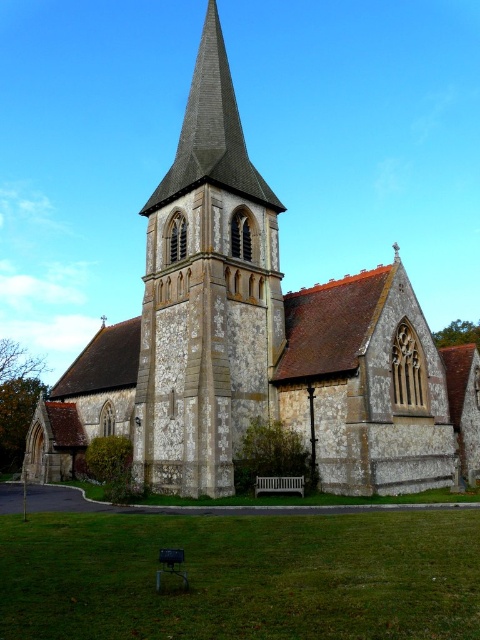
Does stone church at center have a greater height compared to stone spire at center?

Indeed, stone church at center has a greater height compared to stone spire at center.

Can you confirm if stone church at center is shorter than stone spire at center?

Incorrect, stone church at center's height does not fall short of stone spire at center's.

Is point (280, 392) farther from viewer compared to point (268, 355)?

No, (280, 392) is closer to viewer.

Locate an element on the screen. The height and width of the screenshot is (640, 480). stone church at center is located at coordinates (256, 342).